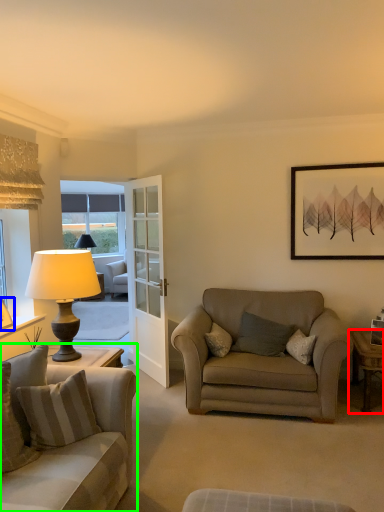
Question: Considering the real-world distances, which object is closest to desk (highlighted by a red box)? picture frame (highlighted by a blue box) or studio couch (highlighted by a green box).

Choices:
 (A) picture frame
 (B) studio couch

Answer: (B)